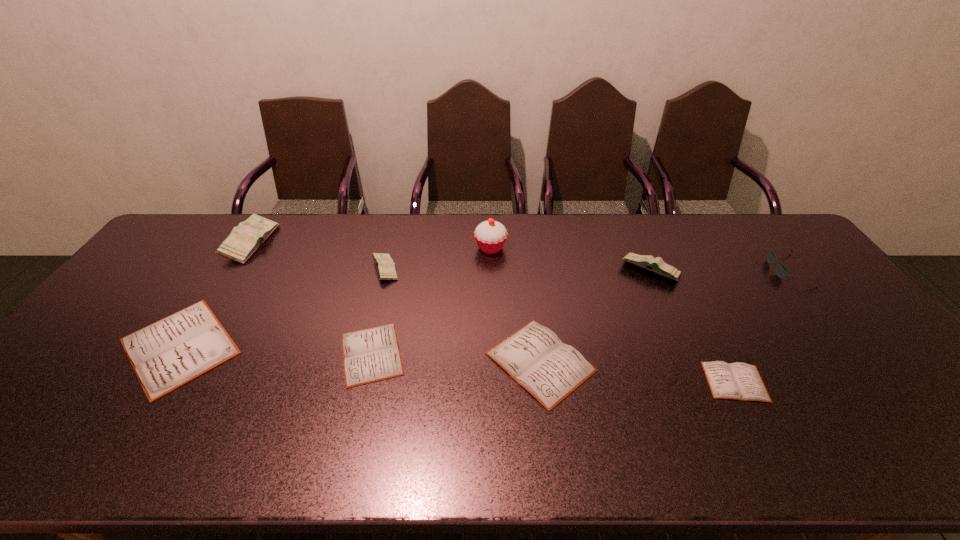
Point out which diary is positioned as the second nearest to the smallest pink diary. Please provide its 2D coordinates. Your answer should be formatted as a tuple, i.e. [(x, y)], where the tuple contains the x and y coordinates of a point satisfying the conditions above.

[(173, 351)]

Identify which diary is located as the third nearest to the rightmost white diary. Please provide its 2D coordinates. Your answer should be formatted as a tuple, i.e. [(x, y)], where the tuple contains the x and y coordinates of a point satisfying the conditions above.

[(373, 354)]

Where is `pink diary that stands as the third closest to the tallest object`? The width and height of the screenshot is (960, 540). pink diary that stands as the third closest to the tallest object is located at coordinates pyautogui.click(x=246, y=238).

Identify which pink diary is the second closest to the second tallest diary. Please provide its 2D coordinates. Your answer should be formatted as a tuple, i.e. [(x, y)], where the tuple contains the x and y coordinates of a point satisfying the conditions above.

[(246, 238)]

Select which white diary appears as the closest to the shortest diary. Please provide its 2D coordinates. Your answer should be formatted as a tuple, i.e. [(x, y)], where the tuple contains the x and y coordinates of a point satisfying the conditions above.

[(534, 356)]

Identify which white diary is located as the nearest to the fifth diary from left to right. Please provide its 2D coordinates. Your answer should be formatted as a tuple, i.e. [(x, y)], where the tuple contains the x and y coordinates of a point satisfying the conditions above.

[(373, 354)]

The image size is (960, 540). Identify the location of vacant space that satisfies the following two spatial constraints: 1. on the front side of the eighth tallest object; 2. on the left side of the fifth shortest diary. (365, 354).

At what (x,y) coordinates should I click in order to perform the action: click on free space that satisfies the following two spatial constraints: 1. on the front side of the sixth tallest object; 2. on the left side of the seventh tallest object. Please return your answer as a coordinate pair (x, y). Looking at the image, I should click on (170, 362).

Find the location of `free location that satisfies the following two spatial constraints: 1. on the front side of the pink cupcake; 2. on the left side of the third diary from right to left`. free location that satisfies the following two spatial constraints: 1. on the front side of the pink cupcake; 2. on the left side of the third diary from right to left is located at coordinates (493, 362).